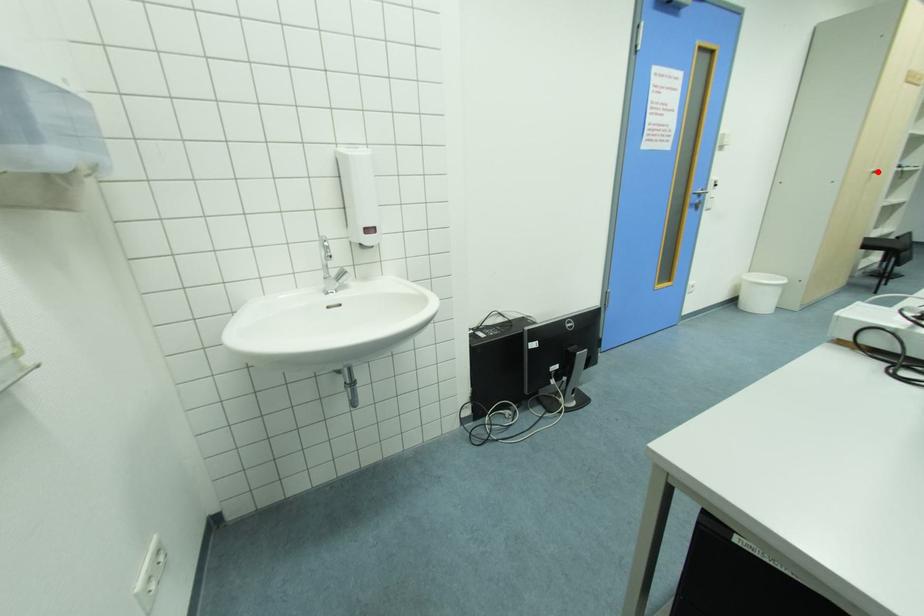
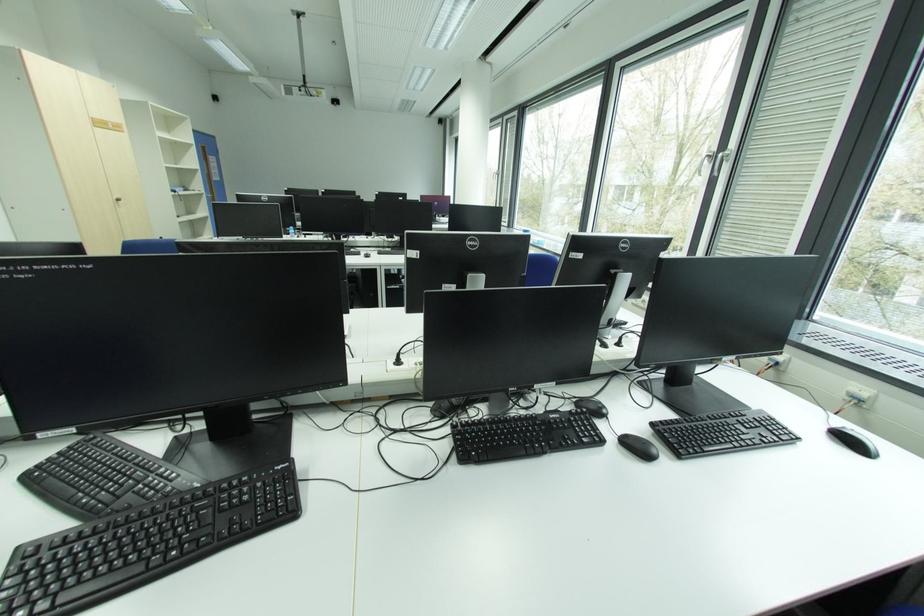
In the second image, find the point that corresponds to the highlighted location in the first image.

(120, 199)